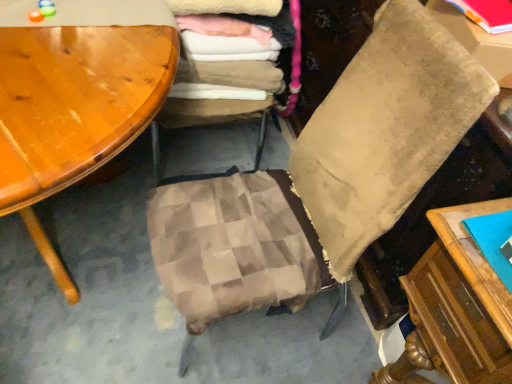
Question: Considering the relative positions of matte cardboard box at upper right and matte red book at upper right in the image provided, is matte cardboard box at upper right to the left or to the right of matte red book at upper right?

Choices:
 (A) right
 (B) left

Answer: (A)

Question: From the image's perspective, is matte cardboard box at upper right above or below matte red book at upper right?

Choices:
 (A) above
 (B) below

Answer: (B)

Question: Which of these objects is positioned farthest from the matte red book at upper right?

Choices:
 (A) beige velvety pillow at center
 (B) soft cotton laundry at center
 (C) plaid fabric cushion at center
 (D) matte cardboard box at upper right

Answer: (C)

Question: Estimate the real-world distances between objects in this image. Which object is closer to the beige velvety pillow at center?

Choices:
 (A) matte cardboard box at upper right
 (B) plaid fabric cushion at center
 (C) soft cotton laundry at center
 (D) matte red book at upper right

Answer: (A)